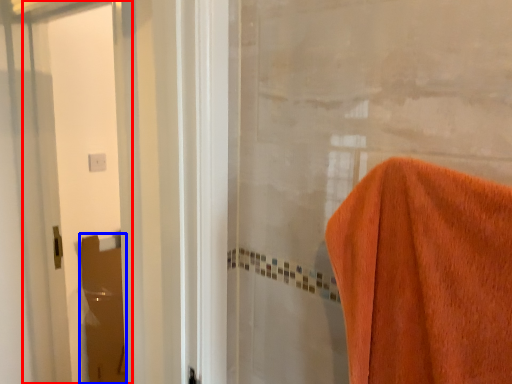
Question: Which object appears farthest to the camera in this image, screen door (highlighted by a red box) or screen door (highlighted by a blue box)?

Choices:
 (A) screen door
 (B) screen door

Answer: (B)